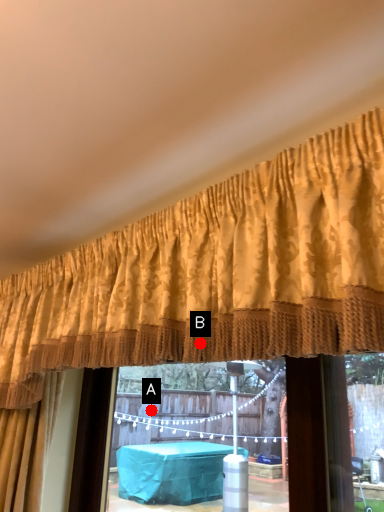
Question: Two points are circled on the image, labeled by A and B beside each circle. Which point is farther to the camera?

Choices:
 (A) A is further
 (B) B is further

Answer: (A)